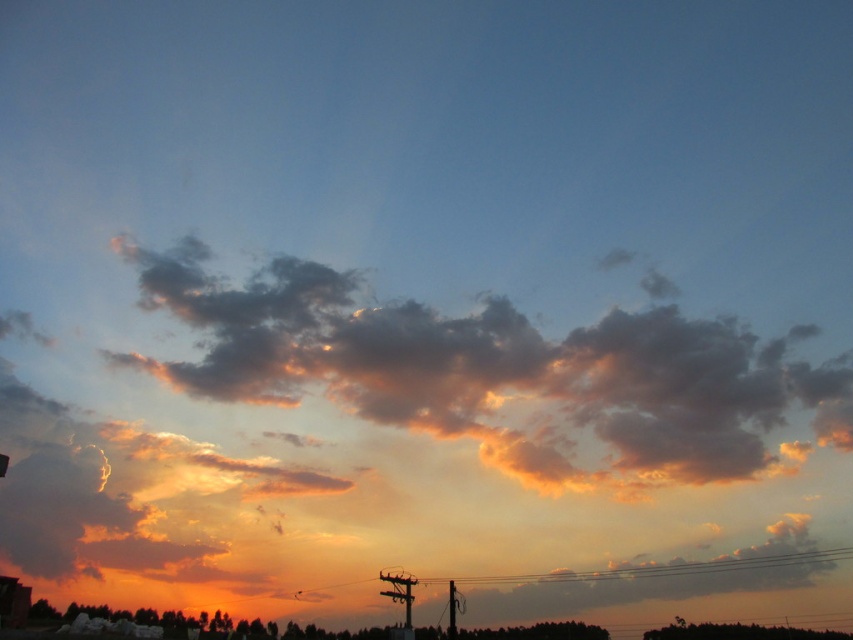
You are standing in the sunset scene and want to reach the two points marked in the image. Which point, point (520, 436) or point (360, 580), will you reach first if you move towards them?

Point (520, 436) is closer to the viewer than point (360, 580), so you will reach point (520, 436) first.